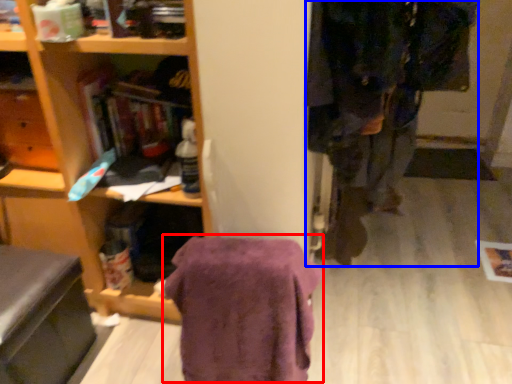
Question: Which of the following is the closest to the observer, blanket (highlighted by a red box) or clothing (highlighted by a blue box)?

Choices:
 (A) blanket
 (B) clothing

Answer: (B)